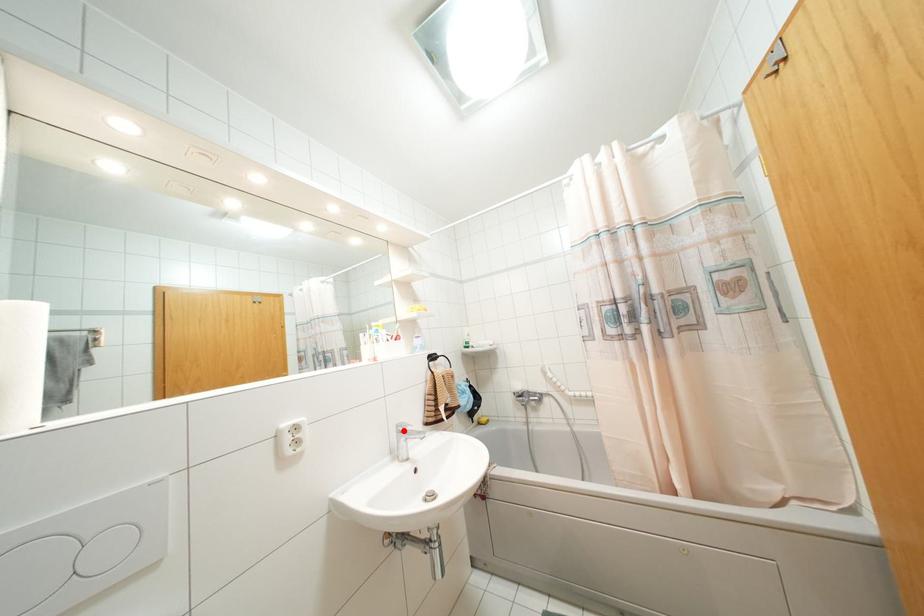
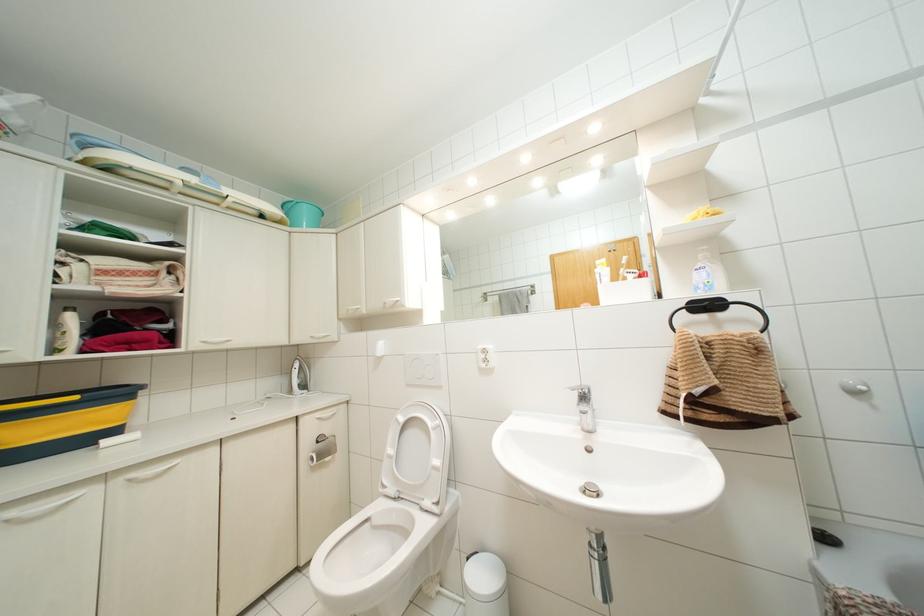
Find the pixel in the second image that matches the highlighted location in the first image.

(584, 395)